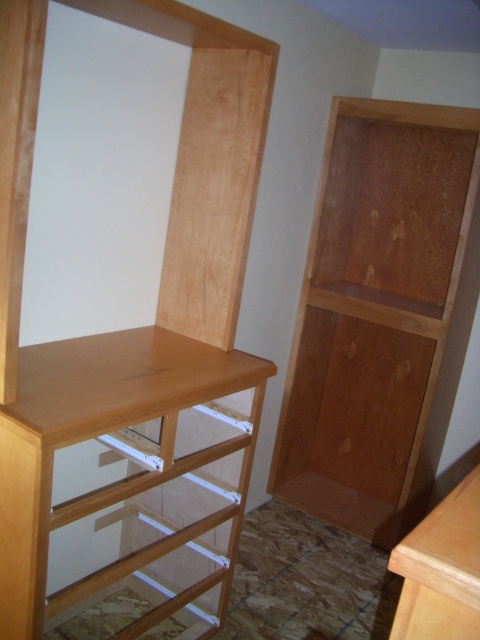
You are moving a 1.2 meter wide sofa into a room with a partially assembled shelving unit. The sofa needs to be placed between the light brown wood bookshelf at left and the natural wood bookshelf at right. Will the sofa fit in the space between them?

The distance between the light brown wood bookshelf at left and natural wood bookshelf at right is 1.04 meters. Since the sofa is 1.2 meters wide, it will not fit in the space between them as the available space is narrower than the sofa.

You are organizing books in a room with a partially assembled shelving unit. You have two bookshelves to place books on. The light brown wood bookshelf at left and the natural wood bookshelf at right. Which bookshelf is positioned to the left side of the other?

The light brown wood bookshelf at left is positioned to the left of the natural wood bookshelf at right.

You are organizing books in a room with a partially assembled shelving unit. You have two bookshelves to place books on. The light brown wood bookshelf at left and the natural wood bookshelf at right. Which bookshelf has more space for books?

The natural wood bookshelf at right has a larger size compared to the light brown wood bookshelf at left, so it has more space for books.